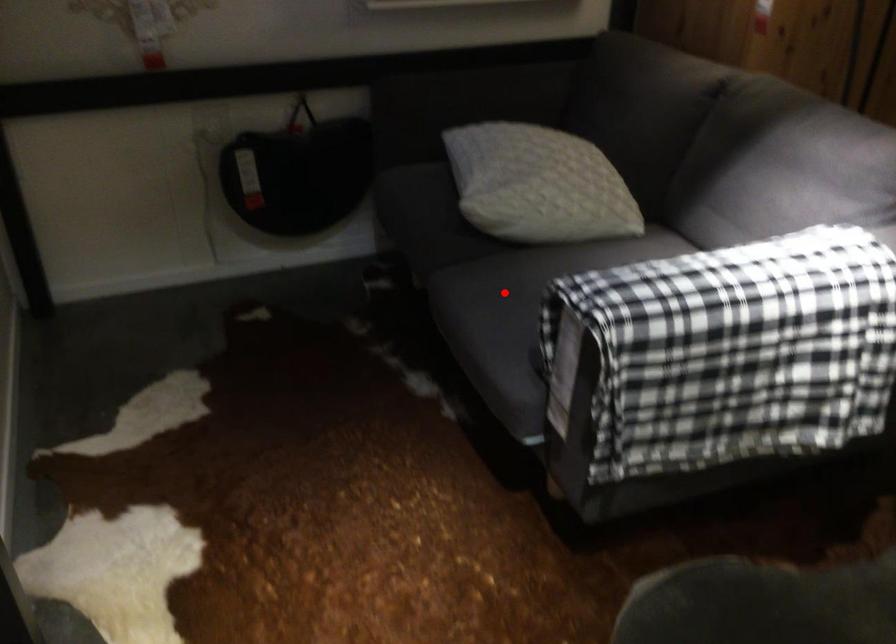
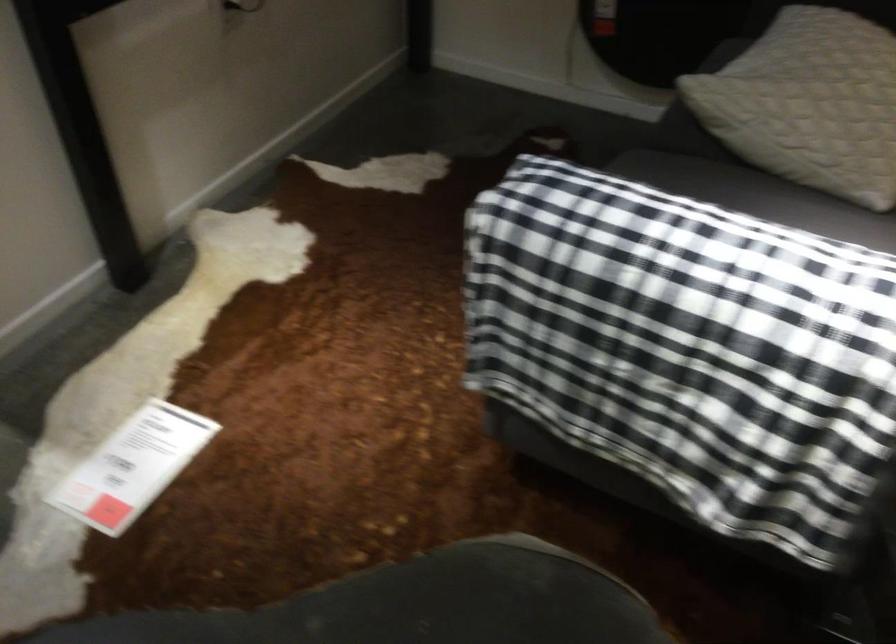
Question: I am providing you with two images of the same scene from different viewpoints. A red point is marked on the first image. Is the red point's position out of view in image 2?

Choices:
 (A) Yes
 (B) No

Answer: (A)